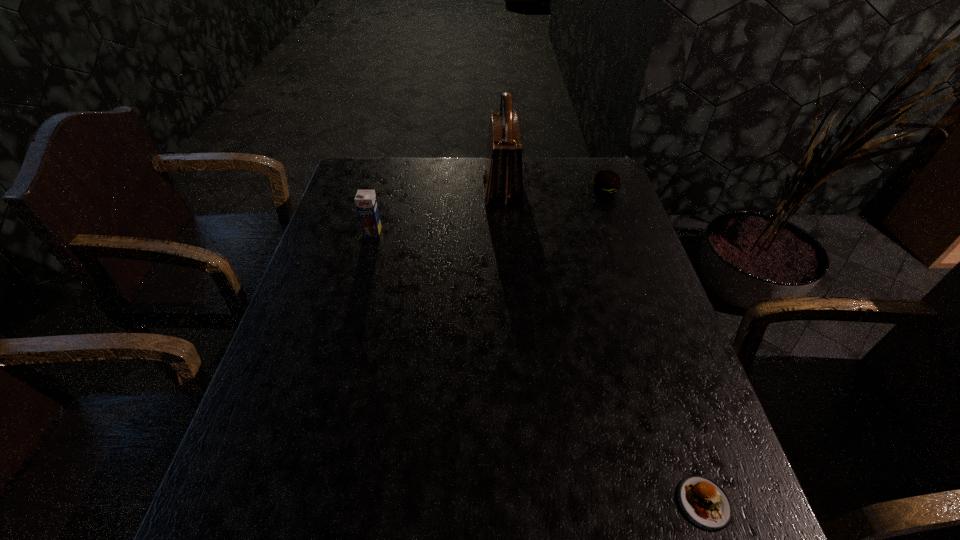
The height and width of the screenshot is (540, 960). I want to click on the second object from left to right, so click(x=503, y=180).

Identify the location of the tallest object. (503, 180).

Image resolution: width=960 pixels, height=540 pixels. Find the location of `the second nearest object`. the second nearest object is located at coordinates click(x=366, y=203).

You are a GUI agent. You are given a task and a screenshot of the screen. Output one action in this format:
    pyautogui.click(x=<x>, y=<y>)
    Task: Click on the second tallest object
    This screenshot has height=540, width=960.
    Given the screenshot: What is the action you would take?
    pyautogui.click(x=366, y=203)

I want to click on the second shortest object, so pyautogui.click(x=606, y=183).

Identify the location of the farther patty (food). (x=606, y=183).

This screenshot has height=540, width=960. What are the coordinates of `the nearer patty (food)` in the screenshot? It's located at (705, 503).

Locate an element on the screen. the shorter patty (food) is located at coordinates (705, 503).

At what (x,y) coordinates should I click in order to perform the action: click on free region located on the front flap of the tallest object. Please return your answer as a coordinate pair (x, y). Looking at the image, I should click on (380, 188).

Where is `free location located on the front flap of the tallest object`? The width and height of the screenshot is (960, 540). free location located on the front flap of the tallest object is located at coordinates (438, 188).